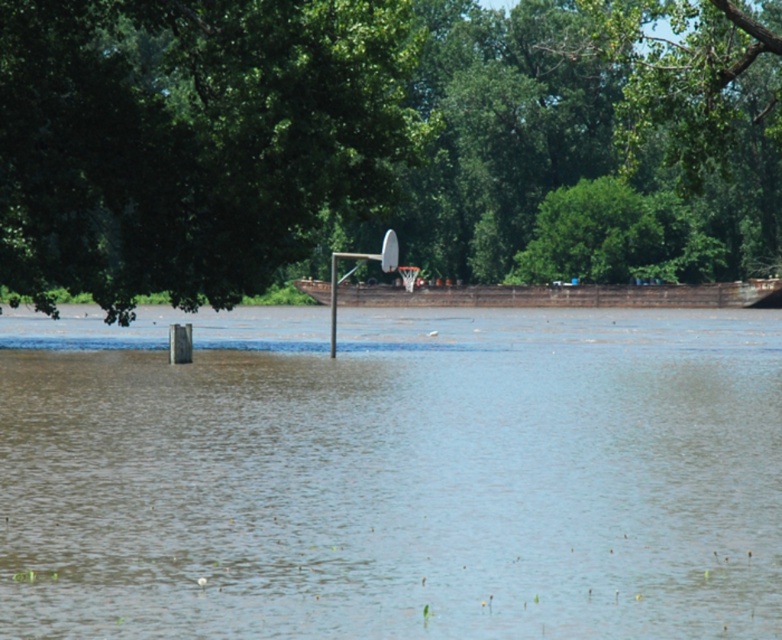
You are a drone operator trying to capture a photo of the flooded basketball court. Your drone has a maximum flight range of 10 meters from its starting point. If you start at the green leafy tree at upper left, will you be able to fly your drone over to the brown muddy water at center to take a photo?

The distance between the green leafy tree at upper left and the brown muddy water at center is 8.18 meters, which is within the drone operator maximum flight range of 10 meters. Yes, the drone can fly from the green leafy tree at upper left to the brown muddy water at center.

You are a drone operator trying to capture a clear aerial view of the metallic silver basketball hoop at center. Considering the brown muddy water at center, will the water obscure the view of the basketball hoop?

Answer: The brown muddy water at center is bigger than the metallic silver basketball hoop at center, so the water will likely obscure the view of the basketball hoop.

You are a bird looking for a perch. You see the green leafy tree at upper left and the metallic silver basketball hoop at center. Which one is taller?

The green leafy tree at upper left is taller than the metallic silver basketball hoop at center.